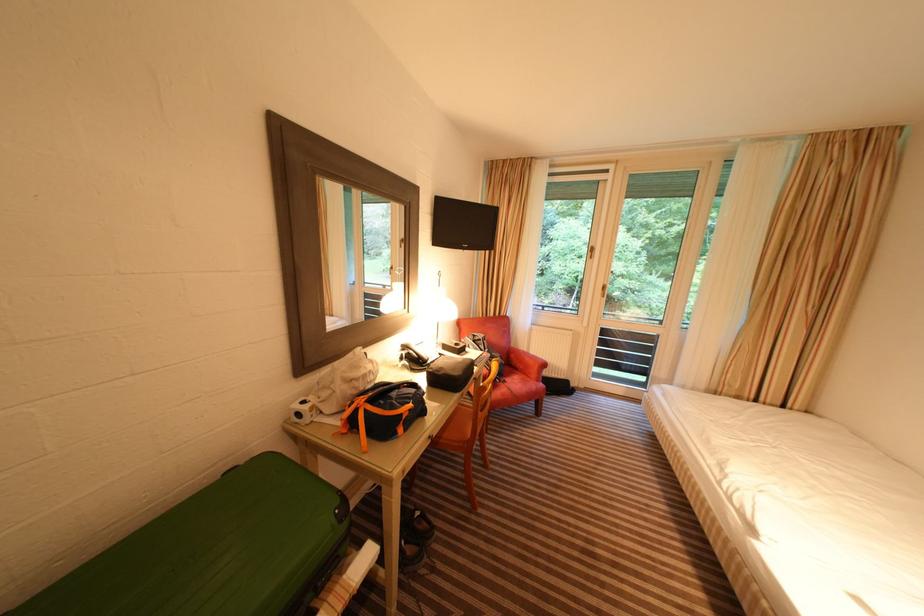
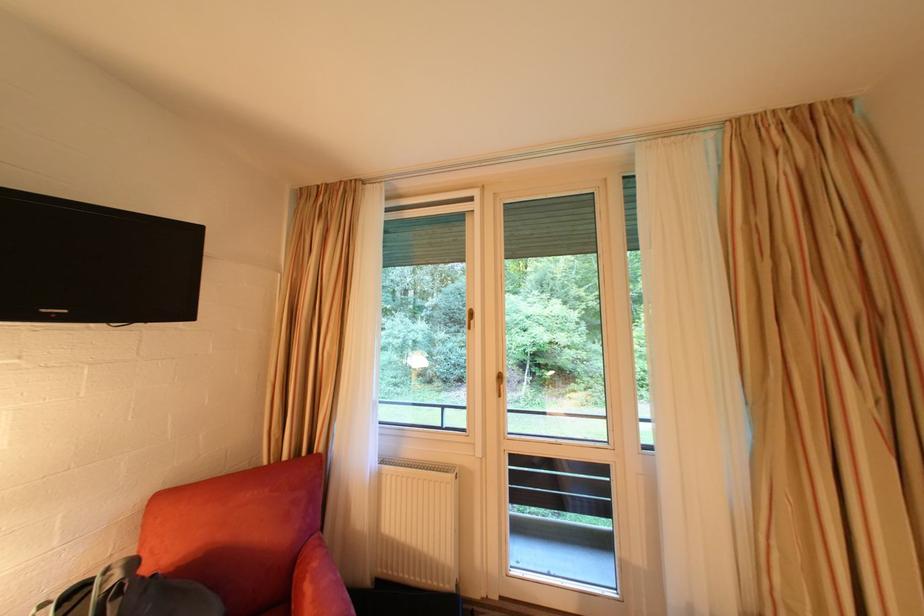
In the scene shown: What movement of the cameraman would produce the second image?

The cameraman walked toward right, forward.